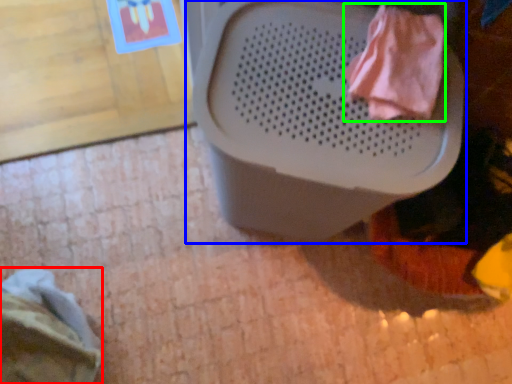
Question: Which object is the closest to the clothing (highlighted by a red box)? Choose among these: waste container (highlighted by a blue box) or clothing (highlighted by a green box).

Choices:
 (A) waste container
 (B) clothing

Answer: (A)